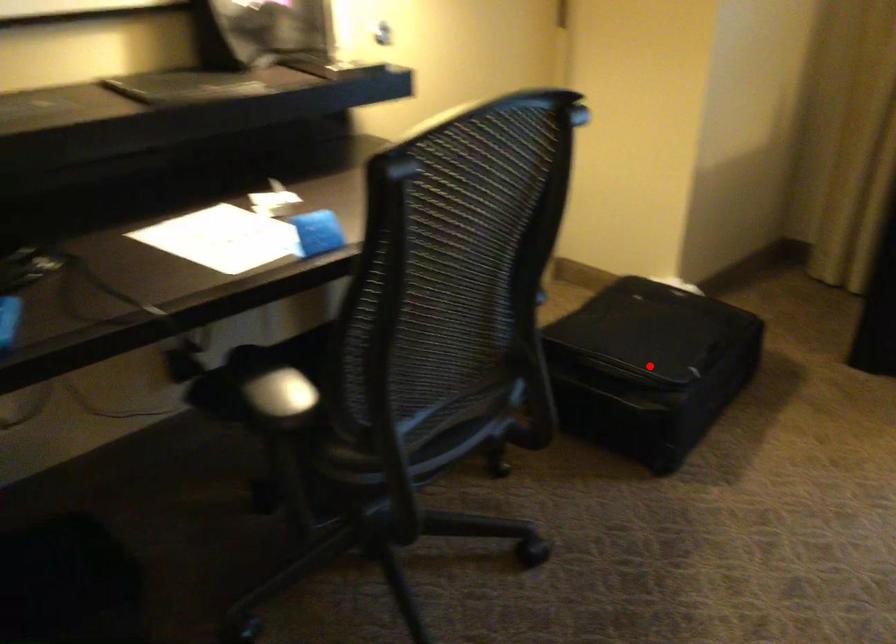
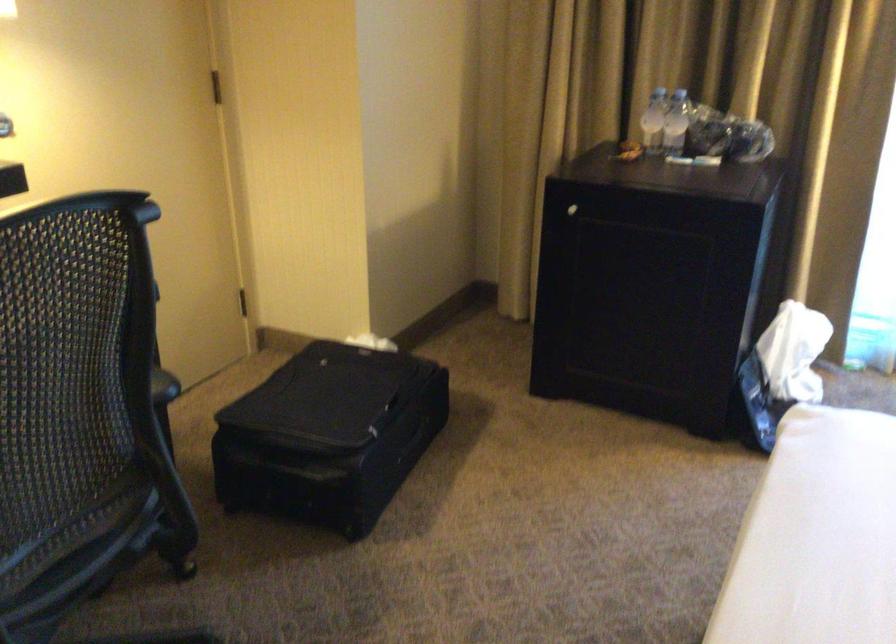
The point at the highlighted location is marked in the first image. Where is the corresponding point in the second image?

(329, 436)